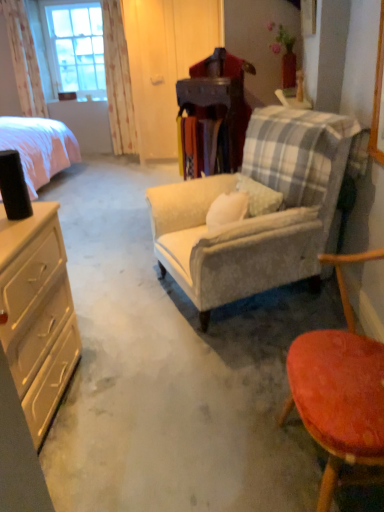
Question: Is clear glass window at upper left taller or shorter than matte beige dresser at left?

Choices:
 (A) tall
 (B) short

Answer: (A)

Question: Is clear glass window at upper left in front of or behind matte beige dresser at left in the image?

Choices:
 (A) front
 (B) behind

Answer: (B)

Question: Which of these objects is positioned closest to the pink fabric bed at left?

Choices:
 (A) velvet beige armchair at center, arranged as the first chair when viewed from the back
 (B) smooth orange stool at lower right, which appears as the second chair when viewed from the back
 (C) clear glass window at upper left
 (D) white floral fabric curtain at upper left, which ranks as the second curtain in right-to-left order
 (E) white floral fabric curtain at upper left, placed as the 1th curtain when sorted from right to left

Answer: (E)

Question: Which object is positioned farthest from the velvet beige armchair at center, arranged as the first chair when viewed from the back?

Choices:
 (A) white floral fabric curtain at upper left, placed as the 1th curtain when sorted from right to left
 (B) white floral fabric curtain at upper left, the first curtain viewed from the left
 (C) pink fabric bed at left
 (D) clear glass window at upper left
 (E) smooth orange stool at lower right, positioned as the first chair in front-to-back order

Answer: (D)